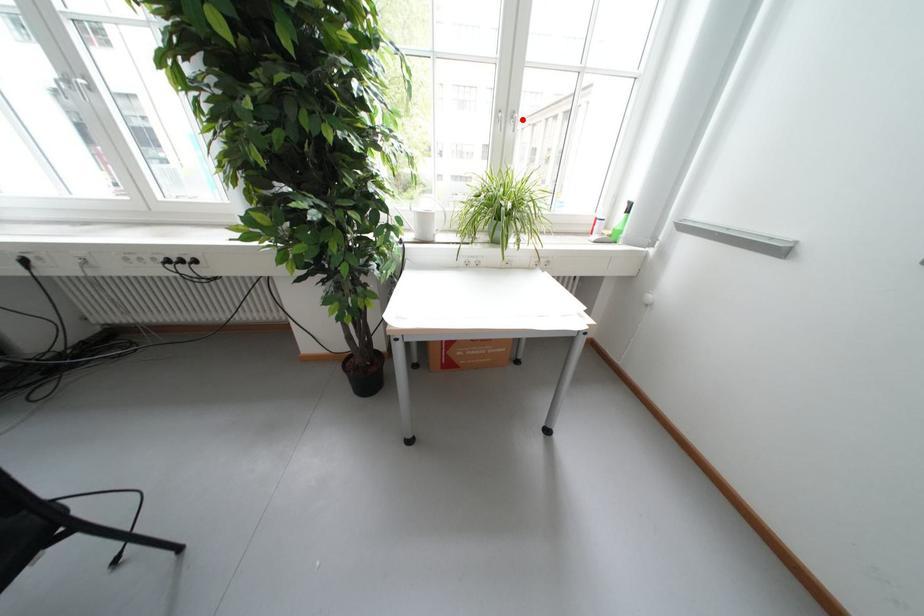
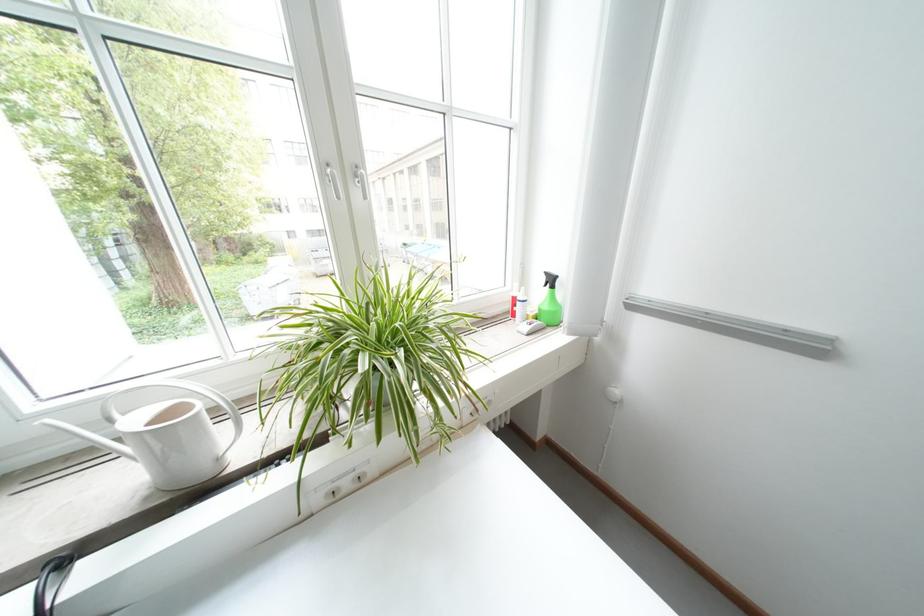
Where in the second image is the point corresponding to the highlighted location from the first image?

(367, 177)